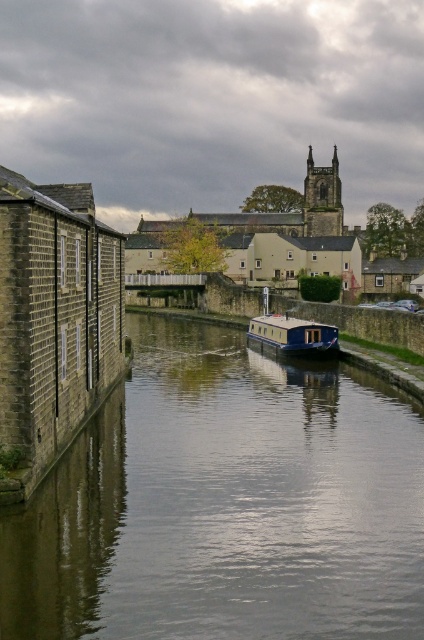
You are planning to moor your small boat at the center of the canal. Given the space between the smooth concrete canal at center and the blue glossy houseboat at center, will there be enough room for your boat to maneuver?

The smooth concrete canal at center is larger in size than the blue glossy houseboat at center, so there should be sufficient space for your boat to maneuver between them.

You are standing at the point marked as point (187, 372) in the canal scene. You want to take a photo of the entire canal boat with blue hull and white superstructure in the center. Will you be able to capture the boat in your photo from your current position?

The distance between you at point (187, 372) and the camera is 181.06 feet. Whether the boat can be captured depends on the camera lens and field of view, but the question does not provide this information. Therefore, it is impossible to determine if the boat will be in the photo from this position.

You are a small toy boat that is 1 meter wide. You want to sail through the smooth concrete canal at center and pass by the blue glossy houseboat at center. Can your toy boat fit through the canal next to the houseboat?

The smooth concrete canal at center might be wider than blue glossy houseboat at center, so there is a possibility that the toy boat can fit through the canal next to the houseboat. However, the exact width difference is uncertain based on the given information.